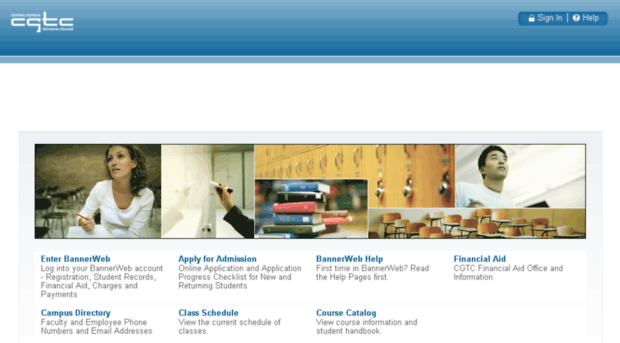
This screenshot has height=343, width=620. What are the coordinates of `books` in the screenshot? It's located at (317, 184), (310, 195), (298, 199), (304, 213), (303, 230), (335, 224), (335, 212).